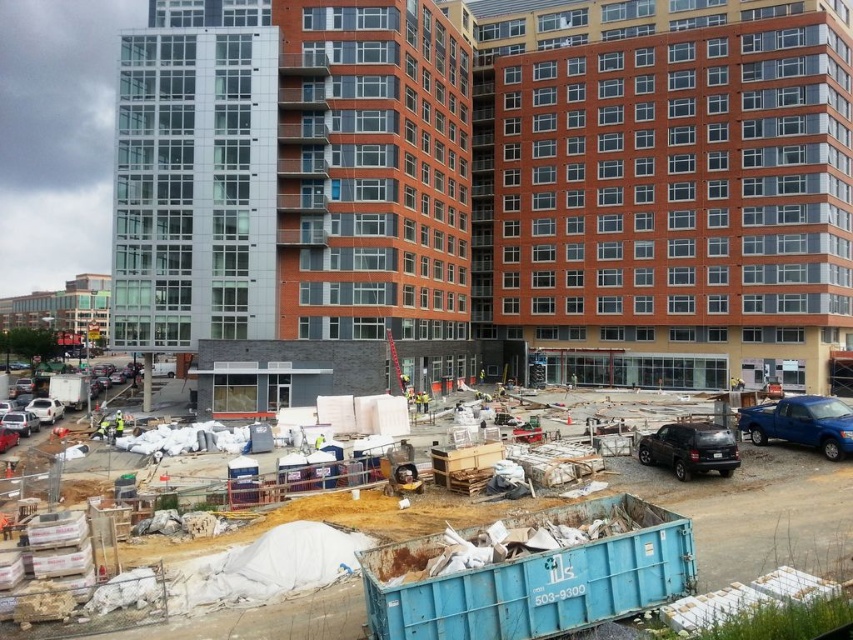
You are standing at the entrance of the construction site and see the point labeled as point (x=755, y=509). What object does this point correspond to?

The point corresponds to the blue plastic container at center.

You are a delivery driver who needs to park your vehicle between the matte black suv at lower right and the silver metallic sedan at lower left. Can your vehicle fit in the space between them?

The matte black suv at lower right is wider than the silver metallic sedan at lower left. Therefore, the space between them may be sufficient for your vehicle, but the exact fit depends on the width of your delivery vehicle compared to the gap between the two cars.

Based on the photo, you are a delivery driver arriving at the construction site. You need to park your vehicle near the silver metallic sedan at lower left. According to the coordinates provided, where should you position your vehicle?

The silver metallic sedan at lower left is located at point (x=20, y=420), so you should position your vehicle near those coordinates to park near it.